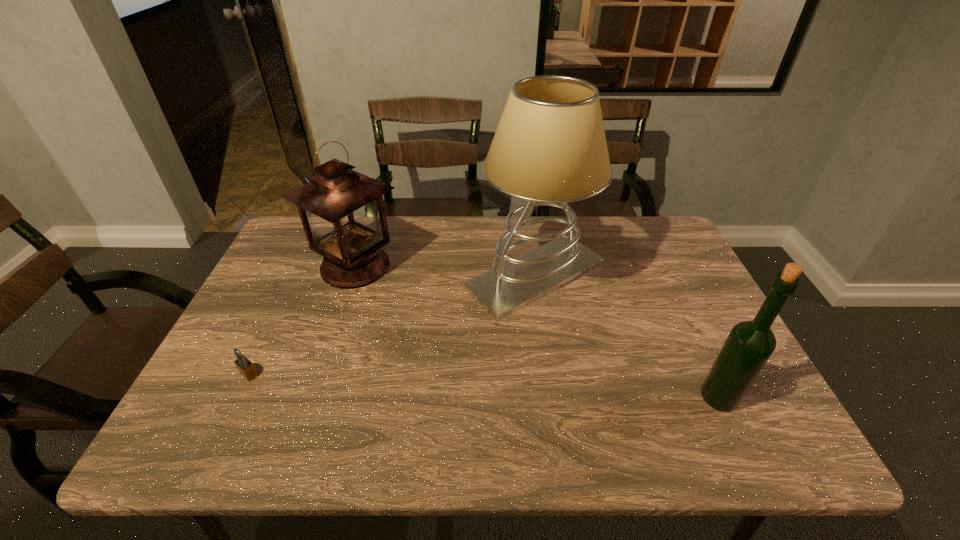
In the image, there is a desktop. Identify the location of free region at the near left corner. This screenshot has height=540, width=960. (171, 452).

Identify the location of vacant space at the far right corner of the desktop. (657, 227).

At what (x,y) coordinates should I click in order to perform the action: click on free space that is in between the table lamp and the rightmost object. Please return your answer as a coordinate pair (x, y). Image resolution: width=960 pixels, height=540 pixels. Looking at the image, I should click on (627, 336).

Image resolution: width=960 pixels, height=540 pixels. Find the location of `free space that is in between the shortest object and the rightmost object`. free space that is in between the shortest object and the rightmost object is located at coordinates (484, 386).

Identify the location of empty location between the nearest object and the second nearest object. (484, 386).

Locate an element on the screen. This screenshot has height=540, width=960. vacant space that's between the second object from right to left and the shortest object is located at coordinates (393, 325).

This screenshot has width=960, height=540. I want to click on unoccupied position between the nearest object and the third object from left to right, so click(627, 336).

Locate an element on the screen. The height and width of the screenshot is (540, 960). free space between the nearest object and the table lamp is located at coordinates (627, 336).

You are a GUI agent. You are given a task and a screenshot of the screen. Output one action in this format:
    pyautogui.click(x=<x>, y=<y>)
    Task: Click on the free space between the table lamp and the oil lamp
    This screenshot has height=540, width=960.
    Given the screenshot: What is the action you would take?
    pyautogui.click(x=445, y=271)

Identify the location of unoccupied area between the second object from right to left and the shortest object. Image resolution: width=960 pixels, height=540 pixels. (393, 325).